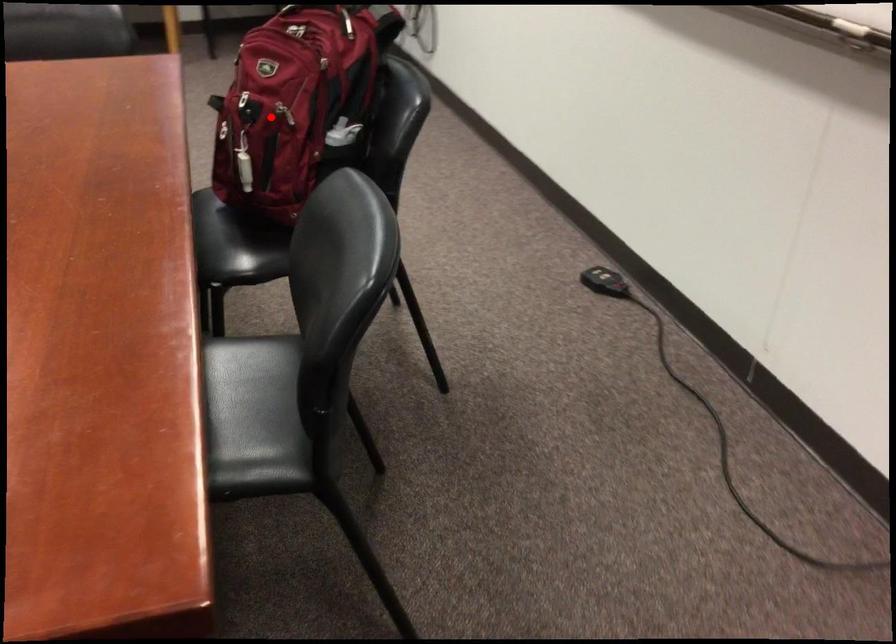
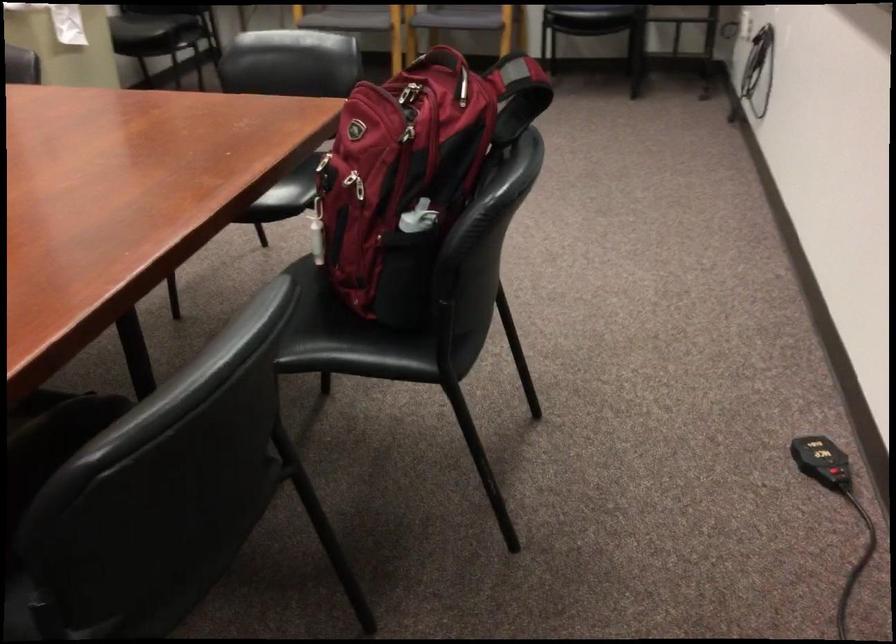
Question: I am providing you with two images of the same scene from different viewpoints. Image1 has a red point marked. In image2, the corresponding 3D location appears at what relative position? Reply with the corresponding letter.

Choices:
 (A) Closer
 (B) Farther

Answer: (A)